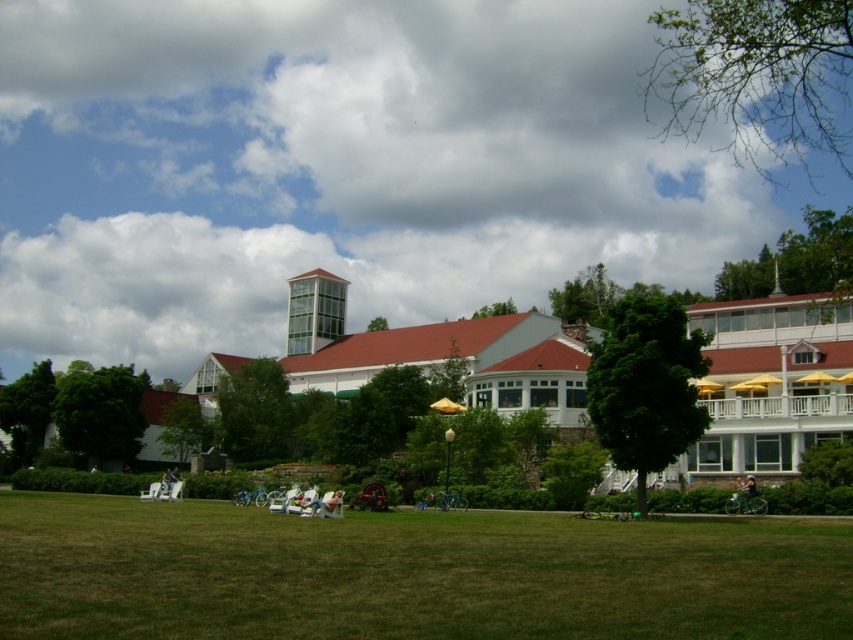
Question: Which object appears closest to the camera in this image?

Choices:
 (A) cloudy sky at upper center
 (B) green grass at lower center

Answer: (B)

Question: Does cloudy sky at upper center appear on the right side of green grass at lower center?

Choices:
 (A) yes
 (B) no

Answer: (B)

Question: Among these objects, which one is farthest from the camera?

Choices:
 (A) green grass at lower center
 (B) cloudy sky at upper center

Answer: (B)

Question: Is cloudy sky at upper center bigger than green grass at lower center?

Choices:
 (A) no
 (B) yes

Answer: (B)

Question: Is cloudy sky at upper center positioned in front of green grass at lower center?

Choices:
 (A) no
 (B) yes

Answer: (A)